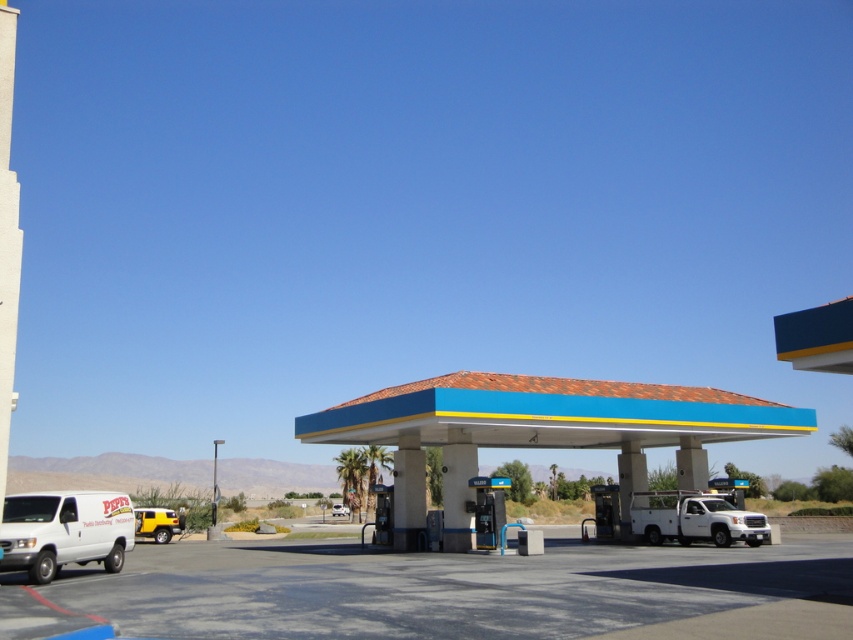
Question: Among these objects, which one is farthest from the camera?

Choices:
 (A) white matte van at lower left
 (B) blue painted concrete gas station at center

Answer: (B)

Question: Is white matte van at lower left thinner than metallic yellow suv at lower left?

Choices:
 (A) yes
 (B) no

Answer: (A)

Question: Can you confirm if blue painted concrete gas station at center is wider than white matte van at lower left?

Choices:
 (A) no
 (B) yes

Answer: (B)

Question: Can you confirm if blue painted concrete gas station at center is positioned below silver metallic suv at center?

Choices:
 (A) no
 (B) yes

Answer: (A)

Question: Which is farther from the silver metallic suv at center?

Choices:
 (A) white matte van at lower left
 (B) metallic yellow suv at lower left

Answer: (A)

Question: Which object is the farthest from the blue painted concrete gas station at center?

Choices:
 (A) metallic yellow suv at lower left
 (B) silver metallic suv at center
 (C) white matte van at lower left

Answer: (B)